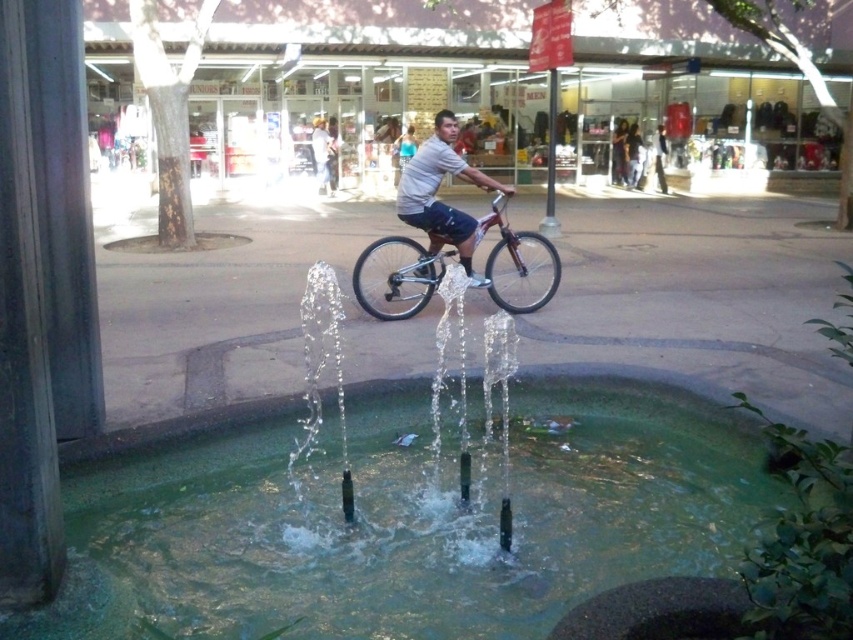
Identify the location of shiny metallic bicycle at center. The width and height of the screenshot is (853, 640). (396, 278).

Does shiny metallic bicycle at center have a lesser width compared to white matte shirt at center?

In fact, shiny metallic bicycle at center might be wider than white matte shirt at center.

Which is behind, point (500, 250) or point (448, 134)?

Positioned behind is point (500, 250).

Find the location of a particular element. The width and height of the screenshot is (853, 640). shiny metallic bicycle at center is located at coordinates (396, 278).

Can you confirm if clear water at center is positioned to the right of shiny metallic bicycle at center?

Incorrect, clear water at center is not on the right side of shiny metallic bicycle at center.

The height and width of the screenshot is (640, 853). Identify the location of clear water at center. (399, 516).

Is clear water at center positioned in front of white matte shirt at center?

Yes.

Which is in front, point (384, 406) or point (465, 253)?

Positioned in front is point (384, 406).

The height and width of the screenshot is (640, 853). In order to click on clear water at center in this screenshot , I will do `click(399, 516)`.